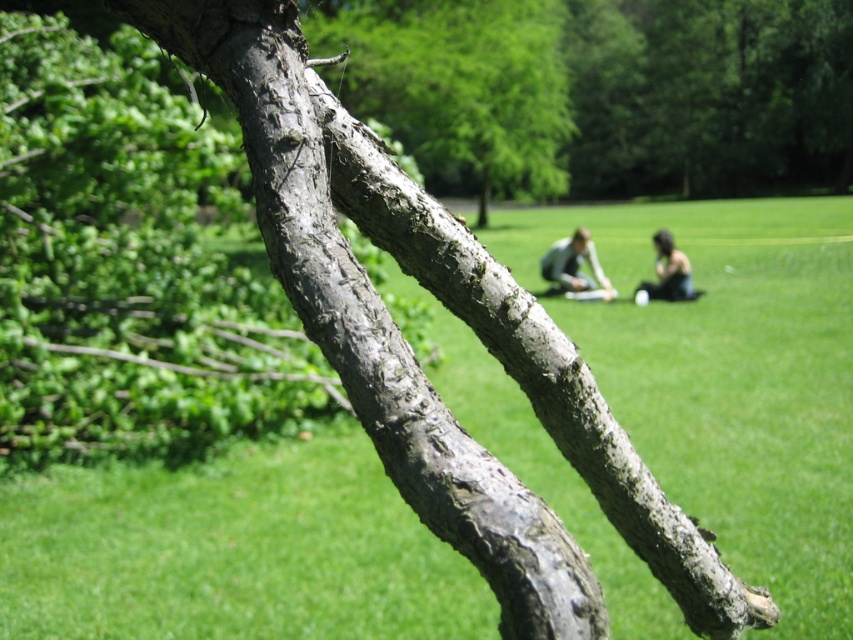
Looking at this image, you are standing in the park scene and want to take a photo of the gray rough bark branch at upper center. According to the coordinates given, where should you aim your camera to capture the branch in the frame?

You should aim your camera at the coordinates point (457, 86) to capture the gray rough bark branch at upper center in the frame.

You are a photographer trying to capture a closeup of the matte gray sweater at center. The gray rough bark branch at upper center is blocking your view. Can you move the branch down to get an unobstructed shot of the sweater?

The gray rough bark branch at upper center is much taller than the matte gray sweater at center, so moving it down would require lowering it below the sweater. However, since the branch is part of the scene, physically moving it might not be feasible. Alternatively, you could adjust your camera angle or position to avoid the obstruction while still focusing on the sweater.

You are standing at the origin of the coordinate system in the image. You see two points marked as point (436, 161) and point (666, 296). Which point is closer to you?

Point (666, 296) is closer to you because it is in front of point (436, 161).